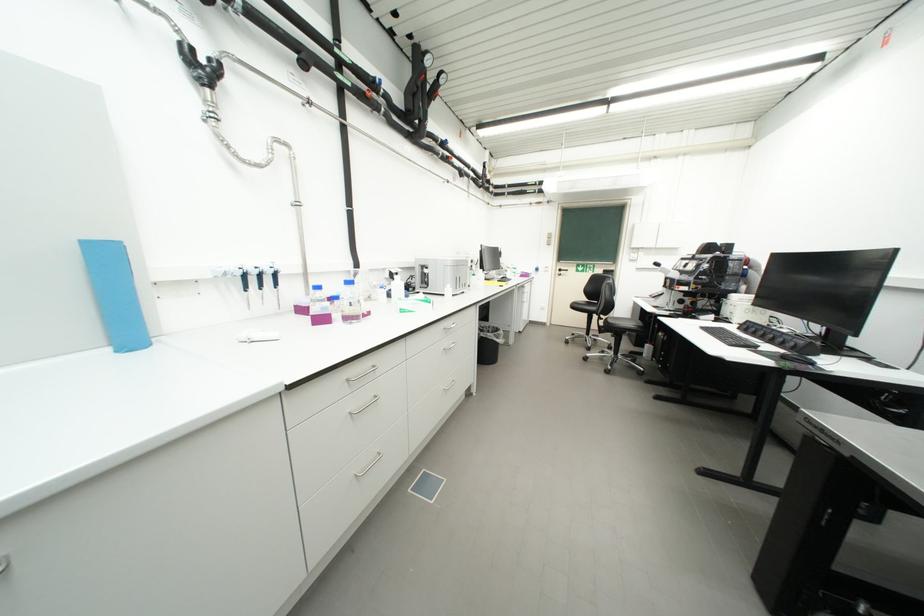
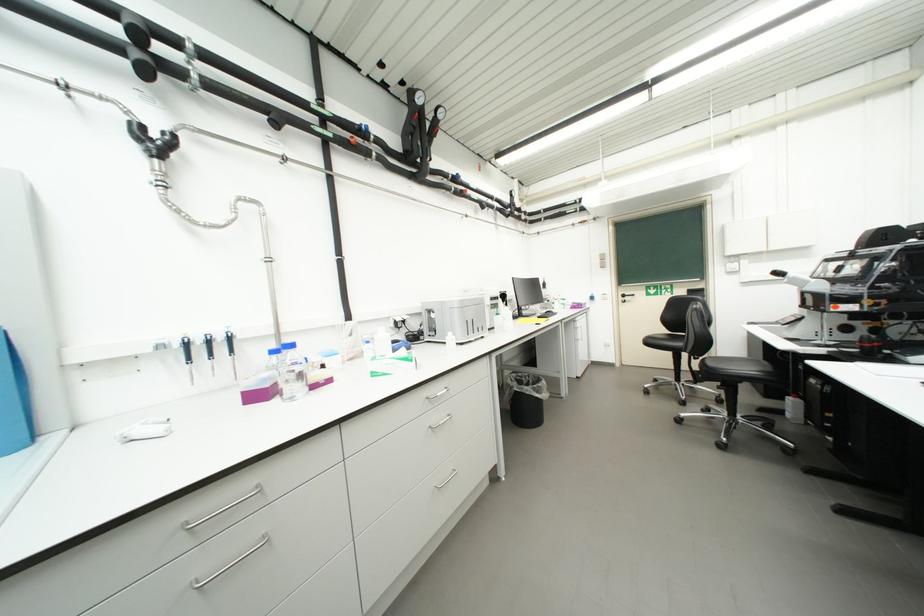
The images are taken continuously from a first-person perspective. In which direction are you moving?

The cameraman walked toward right, forward.